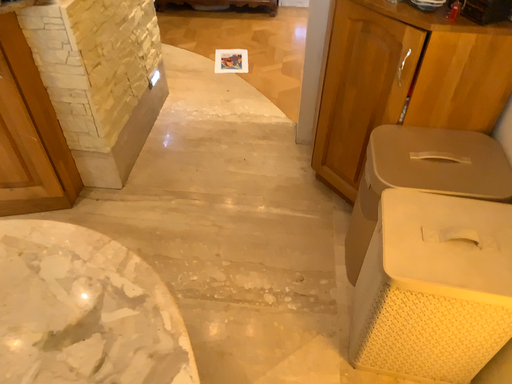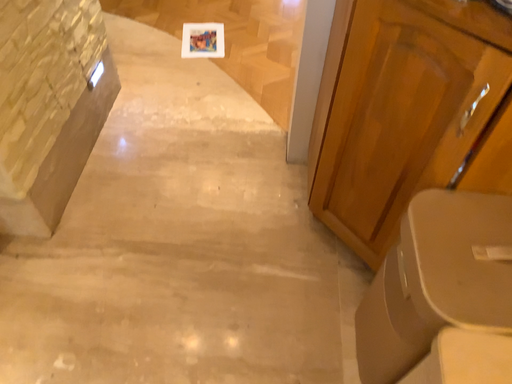
Question: How did the camera likely rotate when shooting the video?

Choices:
 (A) rotated downward
 (B) rotated upward

Answer: (A)